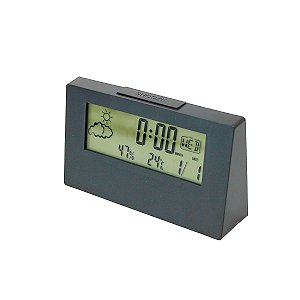
The height and width of the screenshot is (300, 300). I want to click on 1 led screen, so click(x=126, y=129).